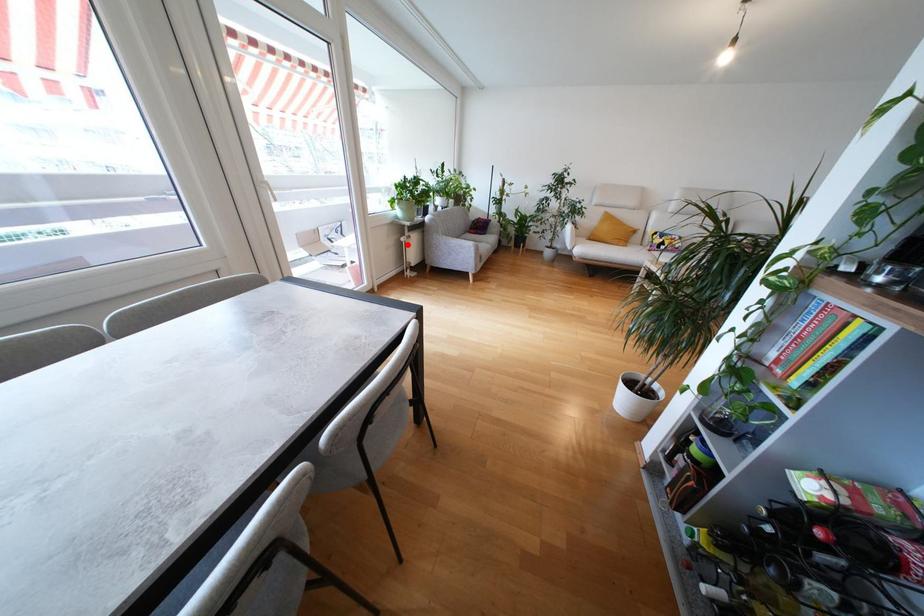
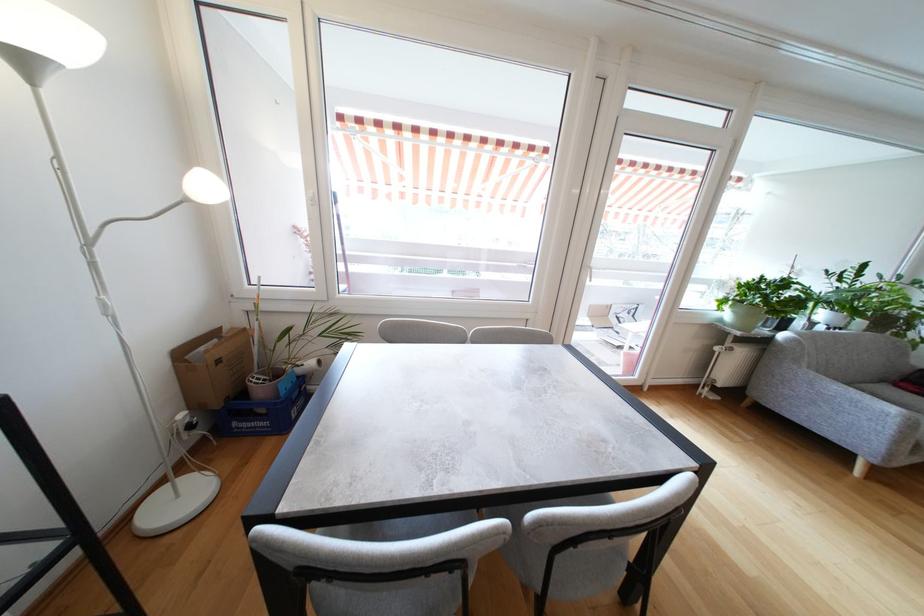
Find the pixel in the second image that matches the highlighted location in the first image.

(721, 355)